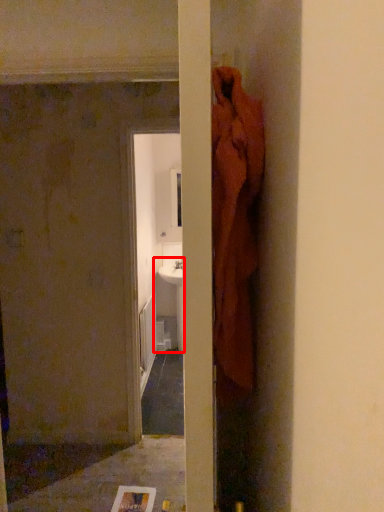
Question: From the image's perspective, where is sink (annotated by the red box) located in relation to concrete in the image?

Choices:
 (A) below
 (B) above

Answer: (B)